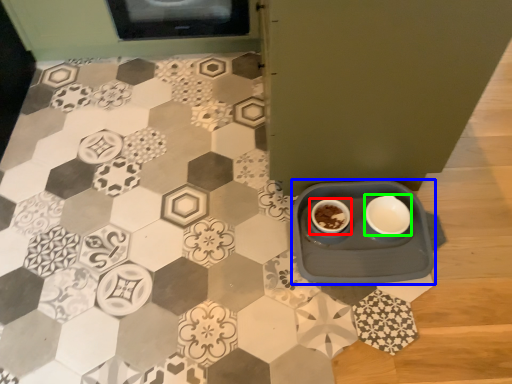
Question: Which object is positioned closest to coffee cup (highlighted by a red box)? Select from table (highlighted by a blue box) and tableware (highlighted by a green box).

Choices:
 (A) table
 (B) tableware

Answer: (A)